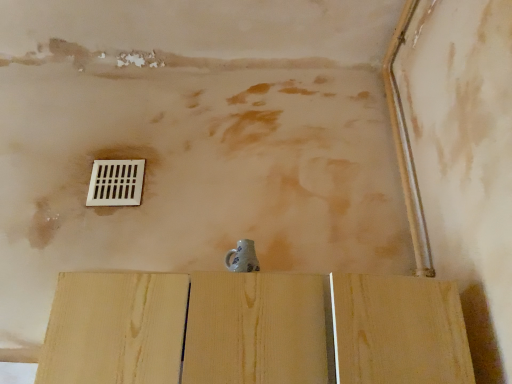
Question: From the image's perspective, would you say natural wood plywood at center is shown under white plastic vent at upper center?

Choices:
 (A) yes
 (B) no

Answer: (A)

Question: Considering the relative positions of natural wood plywood at center and white plastic vent at upper center in the image provided, is natural wood plywood at center to the left of white plastic vent at upper center from the viewer's perspective?

Choices:
 (A) no
 (B) yes

Answer: (A)

Question: Considering the relative positions of natural wood plywood at center and white plastic vent at upper center in the image provided, is natural wood plywood at center in front of white plastic vent at upper center?

Choices:
 (A) no
 (B) yes

Answer: (B)

Question: Does natural wood plywood at center have a lesser width compared to white plastic vent at upper center?

Choices:
 (A) yes
 (B) no

Answer: (B)

Question: Can you confirm if natural wood plywood at center is taller than white plastic vent at upper center?

Choices:
 (A) no
 (B) yes

Answer: (B)

Question: Is there a large distance between natural wood plywood at center and white plastic vent at upper center?

Choices:
 (A) yes
 (B) no

Answer: (B)

Question: Is white plastic vent at upper center positioned beyond the bounds of natural wood plywood at center?

Choices:
 (A) no
 (B) yes

Answer: (B)

Question: From the image's perspective, is white plastic vent at upper center above natural wood plywood at center?

Choices:
 (A) no
 (B) yes

Answer: (B)

Question: Can you confirm if white plastic vent at upper center is taller than natural wood plywood at center?

Choices:
 (A) yes
 (B) no

Answer: (B)

Question: Can you confirm if white plastic vent at upper center is positioned to the left of natural wood plywood at center?

Choices:
 (A) yes
 (B) no

Answer: (A)

Question: Is white plastic vent at upper center closer to the viewer compared to natural wood plywood at center?

Choices:
 (A) yes
 (B) no

Answer: (B)

Question: Is there a large distance between white plastic vent at upper center and natural wood plywood at center?

Choices:
 (A) no
 (B) yes

Answer: (A)

Question: Is point (421, 312) closer or farther from the camera than point (115, 190)?

Choices:
 (A) farther
 (B) closer

Answer: (B)